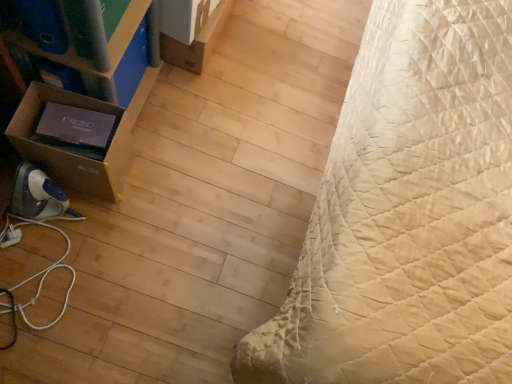
I want to click on free point in front of brown cardboard box at upper left, arranged as the first cardboard box when viewed from the top, so click(x=181, y=107).